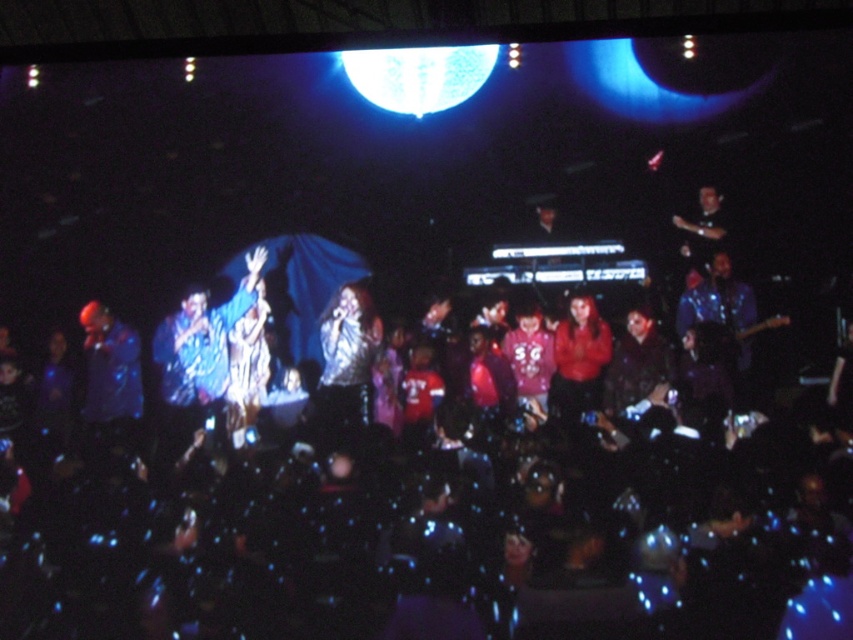
Who is positioned more to the right, shiny silver jacket at center or blue shiny jacket at left?

From the viewer's perspective, shiny silver jacket at center appears more on the right side.

Is shiny silver jacket at center taller than blue shiny jacket at left?

Yes, shiny silver jacket at center is taller than blue shiny jacket at left.

Which is in front, point (334, 413) or point (105, 358)?

Point (334, 413)

In order to click on shiny silver jacket at center in this screenshot , I will do `click(347, 356)`.

Does shiny blue jacket at center have a smaller size compared to shiny silver jacket at center?

No, shiny blue jacket at center is not smaller than shiny silver jacket at center.

Is shiny blue jacket at center behind shiny silver jacket at center?

Yes, it is behind shiny silver jacket at center.

Find the location of a particular element. Image resolution: width=853 pixels, height=640 pixels. shiny blue jacket at center is located at coordinates (200, 348).

This screenshot has height=640, width=853. Find the location of `shiny blue jacket at center`. shiny blue jacket at center is located at coordinates (200, 348).

Is shiny blue jacket at center to the right of blue shiny jacket at left from the viewer's perspective?

Yes, shiny blue jacket at center is to the right of blue shiny jacket at left.

Describe the element at coordinates (200, 348) in the screenshot. Image resolution: width=853 pixels, height=640 pixels. I see `shiny blue jacket at center` at that location.

Identify the location of shiny blue jacket at center. (200, 348).

Find the location of a particular element. shiny blue jacket at center is located at coordinates (200, 348).